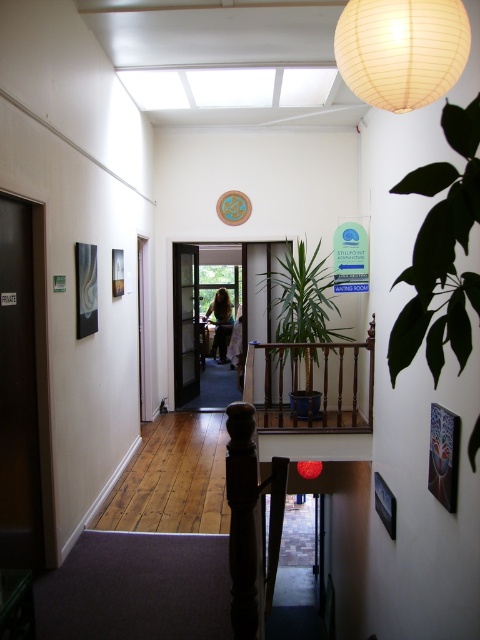
You are a patient entering the hallway of Stillpoint Acupuncture. You notice a green leafy plant at right and a blonde hair at center. Which object is shorter?

The green leafy plant at right is shorter than the blonde hair at center.

You are a patient arriving at Stillpoint Acupuncture and need to find the treatment room. You see a green leafy plant at right and a wooden door at center. Which object is bigger?

The green leafy plant at right is larger in size than the wooden door at center.